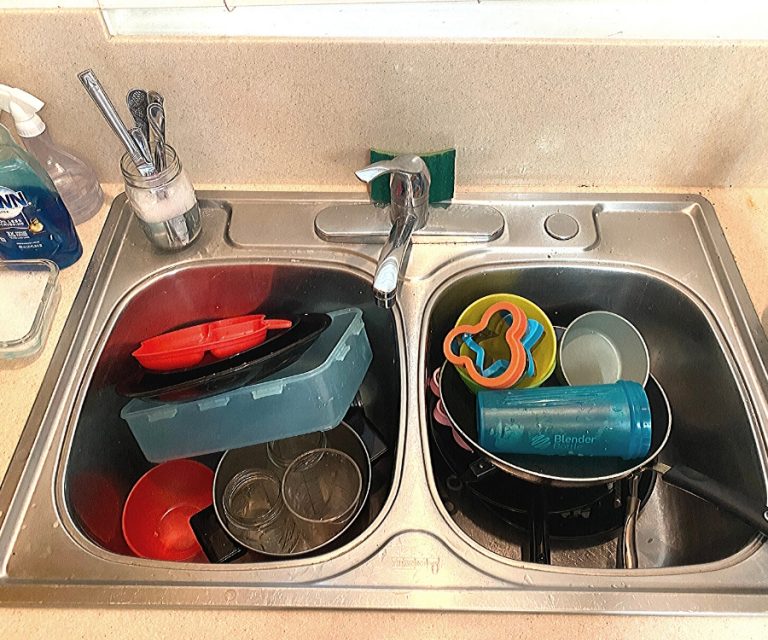
Identify the location of beige wall in background. The width and height of the screenshot is (768, 640). (257, 109), (497, 112), (674, 109), (353, 109).